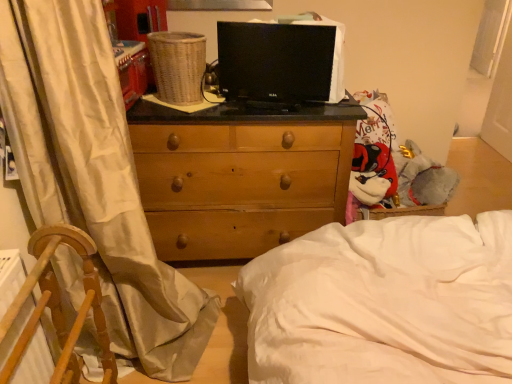
Question: Can white fabric screen door at right be found inside white soft bed at center?

Choices:
 (A) yes
 (B) no

Answer: (B)

Question: Considering the relative sizes of white soft bed at center and white fabric screen door at right in the image provided, is white soft bed at center shorter than white fabric screen door at right?

Choices:
 (A) no
 (B) yes

Answer: (B)

Question: From the image's perspective, does white soft bed at center appear lower than white fabric screen door at right?

Choices:
 (A) yes
 (B) no

Answer: (A)

Question: Does white soft bed at center touch white fabric screen door at right?

Choices:
 (A) yes
 (B) no

Answer: (B)

Question: Is white soft bed at center not inside white fabric screen door at right?

Choices:
 (A) no
 (B) yes

Answer: (B)

Question: Based on their positions, is white soft bed at center located to the left or right of white silk curtain at left?

Choices:
 (A) left
 (B) right

Answer: (B)

Question: Looking at the image, does white soft bed at center seem bigger or smaller compared to white silk curtain at left?

Choices:
 (A) small
 (B) big

Answer: (B)

Question: From the image's perspective, is white soft bed at center above or below white silk curtain at left?

Choices:
 (A) below
 (B) above

Answer: (A)

Question: In terms of width, does white soft bed at center look wider or thinner when compared to white silk curtain at left?

Choices:
 (A) wide
 (B) thin

Answer: (A)

Question: Is point (76, 145) closer or farther from the camera than point (81, 309)?

Choices:
 (A) closer
 (B) farther

Answer: (B)

Question: From their relative heights in the image, would you say white silk curtain at left is taller or shorter than wooden chair at left?

Choices:
 (A) tall
 (B) short

Answer: (A)

Question: From the image's perspective, is white silk curtain at left positioned above or below wooden chair at left?

Choices:
 (A) below
 (B) above

Answer: (B)

Question: In terms of width, does white silk curtain at left look wider or thinner when compared to wooden chair at left?

Choices:
 (A) thin
 (B) wide

Answer: (B)

Question: From the image's perspective, is wooden chest of drawers at center located above or below fluffy plush toy at right?

Choices:
 (A) above
 (B) below

Answer: (B)

Question: In the image, is wooden chest of drawers at center positioned in front of or behind fluffy plush toy at right?

Choices:
 (A) front
 (B) behind

Answer: (A)